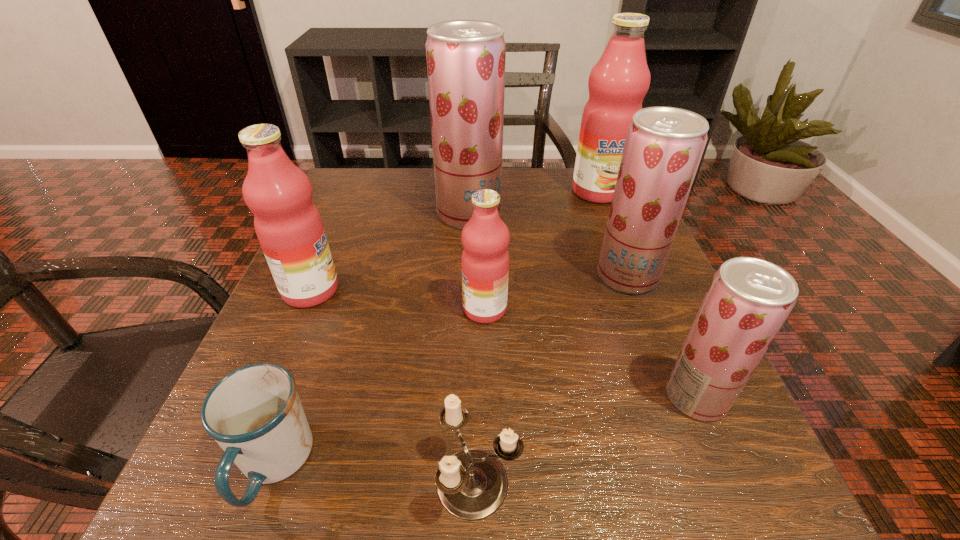
Locate an element on the screen. The width and height of the screenshot is (960, 540). vacant point located on the left of the candle holder is located at coordinates (223, 482).

Image resolution: width=960 pixels, height=540 pixels. Identify the location of candle holder situated at the near edge. 472,484.

In order to click on mug located in the near edge section of the desktop in this screenshot , I will do `click(254, 413)`.

Locate an element on the screen. The width and height of the screenshot is (960, 540). fruit juice positioned at the left edge is located at coordinates (288, 225).

Find the location of a particular element. This screenshot has height=540, width=960. mug located at the left edge is located at coordinates pyautogui.click(x=254, y=413).

At what (x,y) coordinates should I click in order to perform the action: click on object present at the near left corner. Please return your answer as a coordinate pair (x, y). Looking at the image, I should click on (254, 413).

In order to click on object situated at the far right corner in this screenshot , I will do `click(618, 83)`.

Locate an element on the screen. The image size is (960, 540). free region at the far edge of the desktop is located at coordinates 547,175.

Locate an element on the screen. This screenshot has height=540, width=960. vacant space at the near edge of the desktop is located at coordinates (540, 529).

This screenshot has height=540, width=960. I want to click on free region at the left edge of the desktop, so click(350, 348).